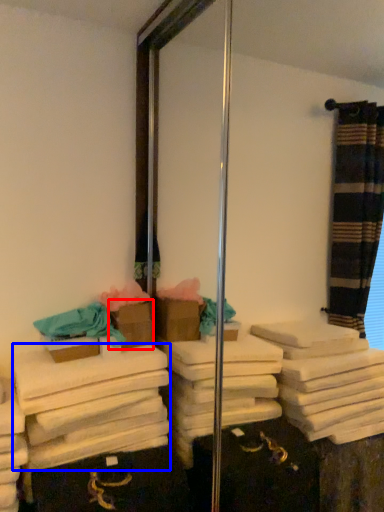
Question: Which object is further to the camera taking this photo, box (highlighted by a red box) or bath towel (highlighted by a blue box)?

Choices:
 (A) box
 (B) bath towel

Answer: (A)